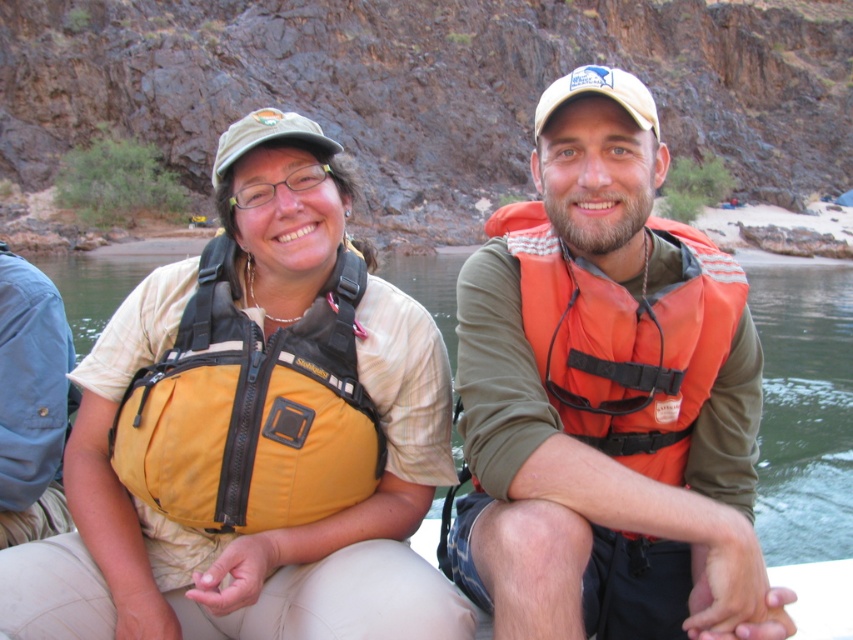
You are a photographer trying to capture the yellow fabric life vest at center. Where exactly should you focus your camera to ensure the vest is in the frame?

You should focus your camera at point (252, 433) to capture the yellow fabric life vest at center.

You are a photographer trying to capture a clear photo of the orange life vest at center and the orange fabric life jacket at center. Which one is closer to the camera?

The orange life vest at center is closer to the camera because it is in front of the orange fabric life jacket at center.

From the picture: You are a safety inspector checking life vests on a boat. You see the orange life vest at center and the orange fabric life jacket at center. Which one has a larger width?

The orange life vest at center might be wider than orange fabric life jacket at center.